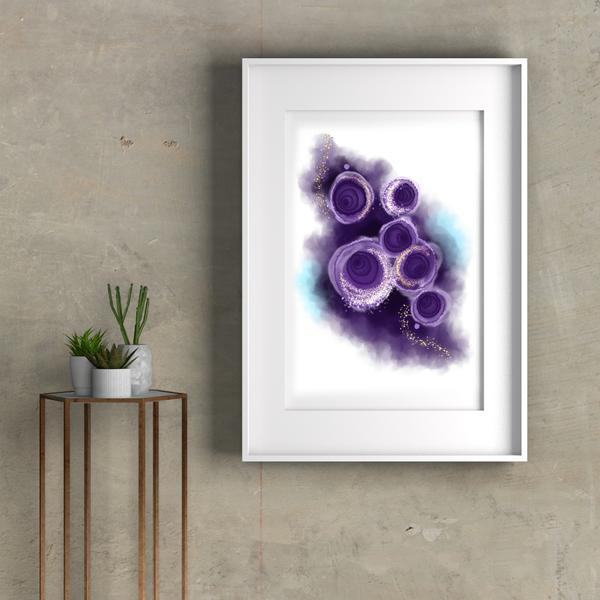
This screenshot has width=600, height=600. What are the coordinates of `wood leg` in the screenshot? It's located at (41, 448), (70, 457), (85, 457), (141, 477), (156, 480), (182, 480).